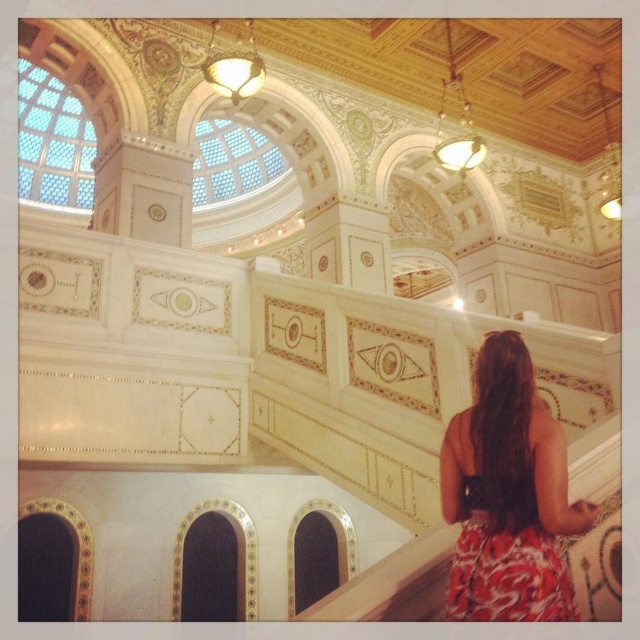
You are a fashion designer standing in the grand room and see both the red floral dress at lower right and the printed fabric dress at lower right. Which dress is closer to you?

The red floral dress at lower right is closer to you because it is further to the viewer than the printed fabric dress at lower right.

You are a fashion designer observing two dresses displayed in an opulent room. The red floral dress at lower right and the printed fabric dress at lower right are both on display. Which dress is positioned higher on the display rack?

The red floral dress at lower right is located above the printed fabric dress at lower right, so it is positioned higher on the display rack.